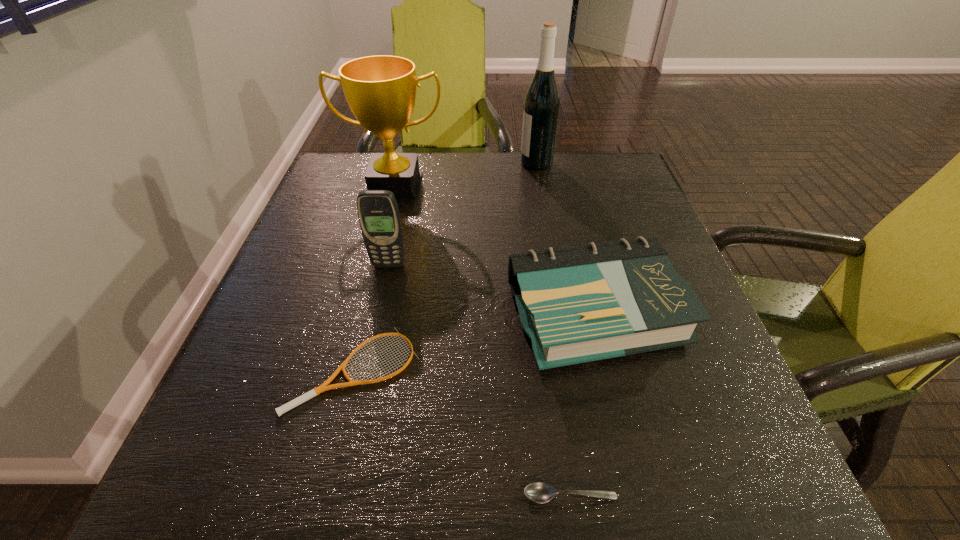
Where is `free space between the third tallest object and the tallest object`? free space between the third tallest object and the tallest object is located at coordinates (463, 214).

Locate an element on the screen. The image size is (960, 540). free space between the tallest object and the tennis racket is located at coordinates (445, 266).

You are a GUI agent. You are given a task and a screenshot of the screen. Output one action in this format:
    pyautogui.click(x=<x>, y=<y>)
    Task: Click on the vacant space in between the third shortest object and the tallest object
    This screenshot has width=960, height=540.
    Given the screenshot: What is the action you would take?
    pyautogui.click(x=565, y=238)

Where is `blank region between the tennis racket and the fifth shortest object`? Image resolution: width=960 pixels, height=540 pixels. blank region between the tennis racket and the fifth shortest object is located at coordinates (375, 278).

Where is `vacant area that lies between the wine bottle and the second tallest object`? The image size is (960, 540). vacant area that lies between the wine bottle and the second tallest object is located at coordinates (466, 174).

This screenshot has width=960, height=540. I want to click on blank region between the tennis racket and the fourth shortest object, so click(372, 318).

The width and height of the screenshot is (960, 540). I want to click on free spot between the tennis racket and the award, so click(x=375, y=278).

Locate which object ranks second in proximity to the third tallest object. Please provide its 2D coordinates. Your answer should be formatted as a tuple, i.e. [(x, y)], where the tuple contains the x and y coordinates of a point satisfying the conditions above.

[(579, 304)]

Identify which object is located as the nearest to the tallest object. Please provide its 2D coordinates. Your answer should be formatted as a tuple, i.e. [(x, y)], where the tuple contains the x and y coordinates of a point satisfying the conditions above.

[(380, 90)]

Find the location of a particular element. free space that satisfies the following two spatial constraints: 1. on the front-facing side of the third shortest object; 2. on the right side of the award is located at coordinates tap(362, 314).